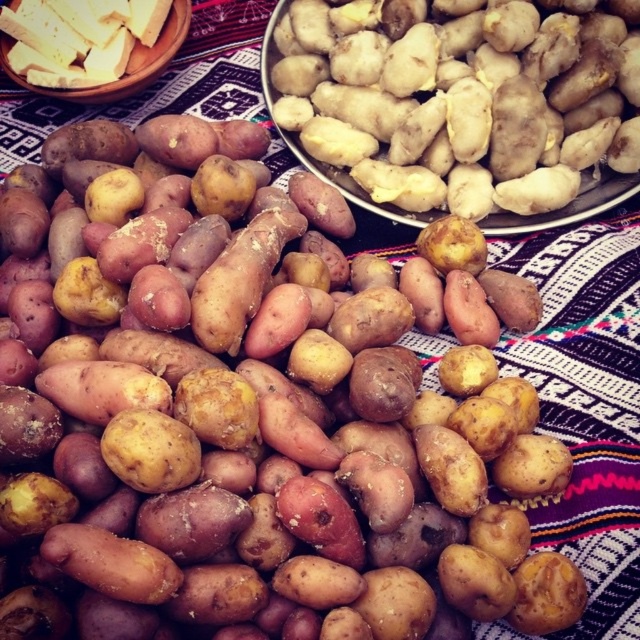
You are arranging a food display and need to place the smooth beige potato at center and the yellowish crumbly cheese at upper left. The display requires that the wider item be placed in the center. Which item should you place in the center?

The smooth beige potato at center should be placed in the center because its width surpasses that of the yellowish crumbly cheese at upper left.

You are standing in front of a display of fresh potatoes and yuca roots. You see two points marked in the image. The first point is at coordinate point [448,125] and the second is at point [52,3]. Which point is closer to you?

Point [448,125] is in front of point [52,3], so the first point is closer to you.

You are preparing a snack and have both the smooth beige potato at center and the yellowish crumbly cheese at upper left in front of you. Which object is larger in size?

The smooth beige potato at center is bigger than the yellowish crumbly cheese at upper left, so the smooth beige potato at center is larger.